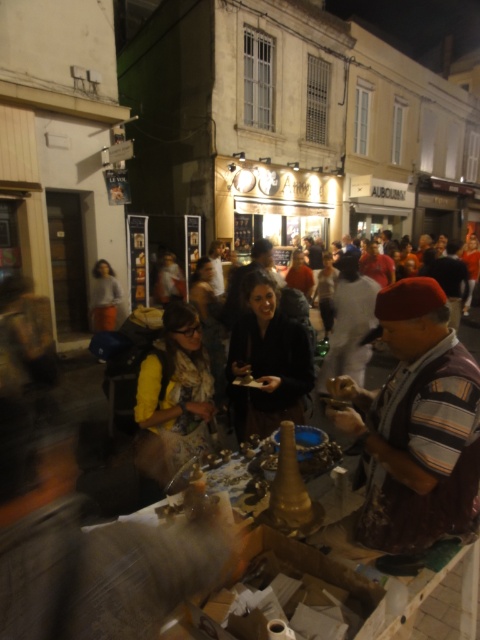
Is striped fabric beret at center taller than wooden table at center?

Yes, striped fabric beret at center is taller than wooden table at center.

Which of these two, striped fabric beret at center or wooden table at center, stands taller?

striped fabric beret at center is taller.

Identify the location of striped fabric beret at center. The width and height of the screenshot is (480, 640). (415, 426).

Is yellow fabric at center below wooden table at center?

Incorrect, yellow fabric at center is not positioned below wooden table at center.

Can you confirm if yellow fabric at center is thinner than wooden table at center?

Yes, yellow fabric at center is thinner than wooden table at center.

Does point (158, 467) lie in front of point (319, 483)?

No, it is behind (319, 483).

You are a GUI agent. You are given a task and a screenshot of the screen. Output one action in this format:
    pyautogui.click(x=<x>, y=<y>)
    Task: Click on the yellow fabric at center
    
    Given the screenshot: What is the action you would take?
    pyautogui.click(x=173, y=394)

Does dark brown leather jacket at center have a greater width compared to wooden table at center?

No.

Can you confirm if dark brown leather jacket at center is positioned below wooden table at center?

No.

This screenshot has width=480, height=640. I want to click on dark brown leather jacket at center, so click(x=266, y=362).

Identify the location of dark brown leather jacket at center. (266, 362).